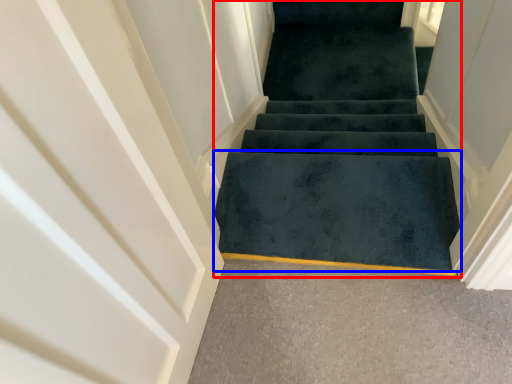
Question: Among these objects, which one is nearest to the camera, stairs (highlighted by a red box) or doormat (highlighted by a blue box)?

Choices:
 (A) stairs
 (B) doormat

Answer: (A)